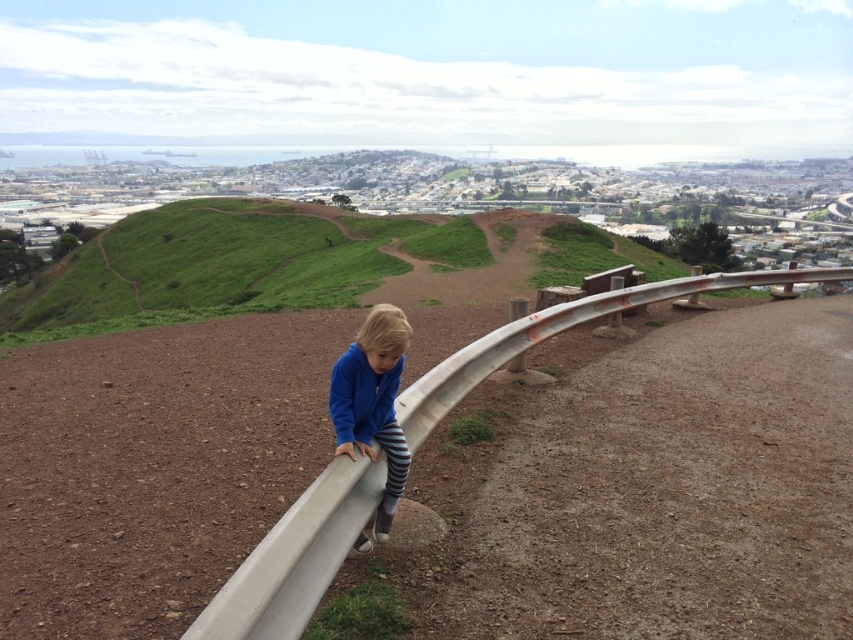
You are a hiker who has just reached the viewpoint. You notice a white matte rail at center and a blue fleece jacket at center. Which object takes up more space in your field of view?

The white matte rail at center is larger in size than the blue fleece jacket at center, so the white matte rail at center takes up more space in your field of view.